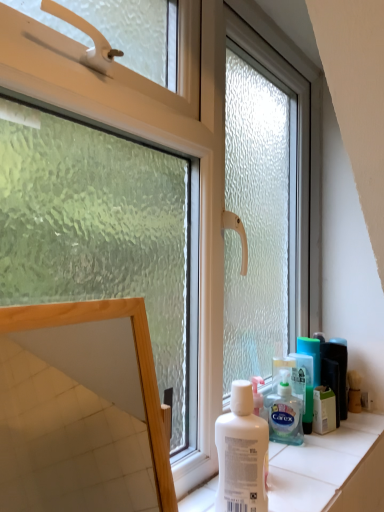
Question: Is wooden frame mirror at lower left inside white matte bottle at center?

Choices:
 (A) yes
 (B) no

Answer: (B)

Question: From a real-world perspective, is white matte bottle at center under wooden frame mirror at lower left?

Choices:
 (A) no
 (B) yes

Answer: (B)

Question: Are white matte bottle at center and wooden frame mirror at lower left located far from each other?

Choices:
 (A) no
 (B) yes

Answer: (B)

Question: Does white matte bottle at center have a greater height compared to wooden frame mirror at lower left?

Choices:
 (A) no
 (B) yes

Answer: (A)

Question: From a real-world perspective, is white matte bottle at center over wooden frame mirror at lower left?

Choices:
 (A) no
 (B) yes

Answer: (A)

Question: Is translucent plastic shaving cream at lower right inside or outside of white matte bottle at center?

Choices:
 (A) outside
 (B) inside

Answer: (A)

Question: Does point (276, 437) appear closer or farther from the camera than point (221, 437)?

Choices:
 (A) closer
 (B) farther

Answer: (B)

Question: In the image, is translucent plastic shaving cream at lower right positioned in front of or behind white matte bottle at center?

Choices:
 (A) front
 (B) behind

Answer: (B)

Question: In terms of size, does translucent plastic shaving cream at lower right appear bigger or smaller than white matte bottle at center?

Choices:
 (A) small
 (B) big

Answer: (A)

Question: Looking at the image, does white plastic box at right seem bigger or smaller compared to wooden frame mirror at lower left?

Choices:
 (A) small
 (B) big

Answer: (A)

Question: Choose the correct answer: Is white plastic box at right inside wooden frame mirror at lower left or outside it?

Choices:
 (A) inside
 (B) outside

Answer: (B)

Question: Considering their positions, is white plastic box at right located in front of or behind wooden frame mirror at lower left?

Choices:
 (A) behind
 (B) front

Answer: (A)

Question: Is point click(326, 418) closer or farther from the camera than point click(87, 414)?

Choices:
 (A) farther
 (B) closer

Answer: (B)

Question: Is wooden frame mirror at lower left taller or shorter than white matte bottle at center?

Choices:
 (A) short
 (B) tall

Answer: (B)

Question: Considering their positions, is wooden frame mirror at lower left located in front of or behind white matte bottle at center?

Choices:
 (A) behind
 (B) front

Answer: (B)